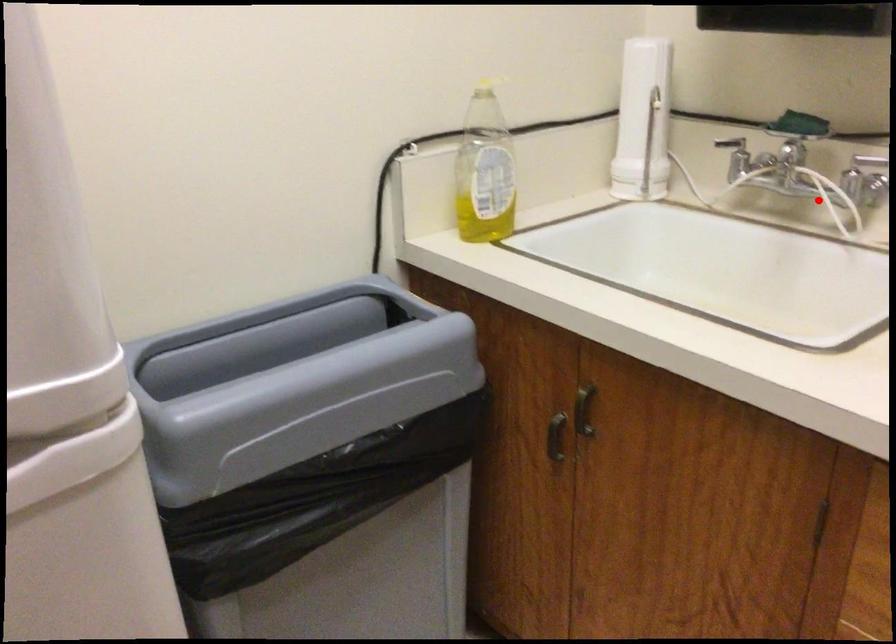
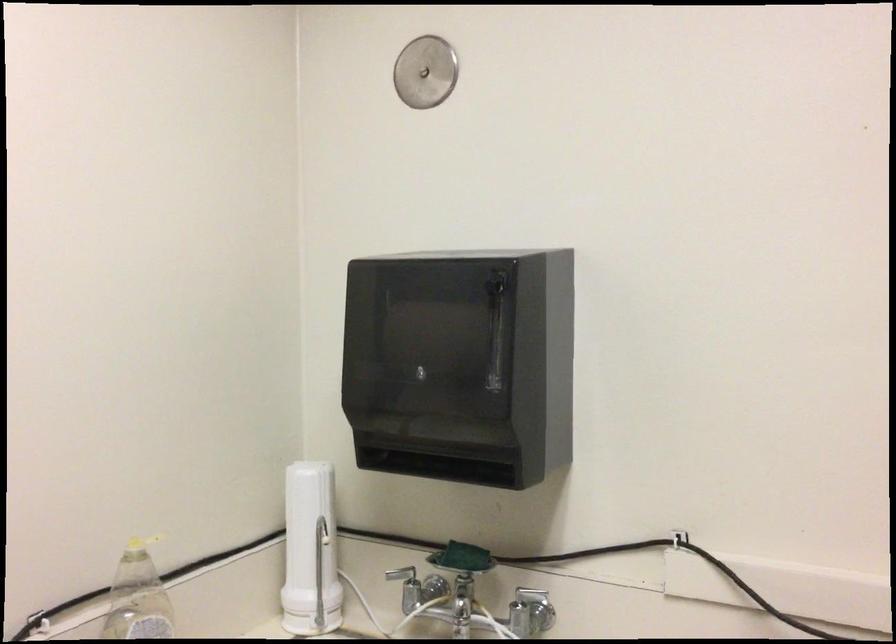
In the second image, find the point that corresponds to the highlighted location in the first image.

(490, 621)